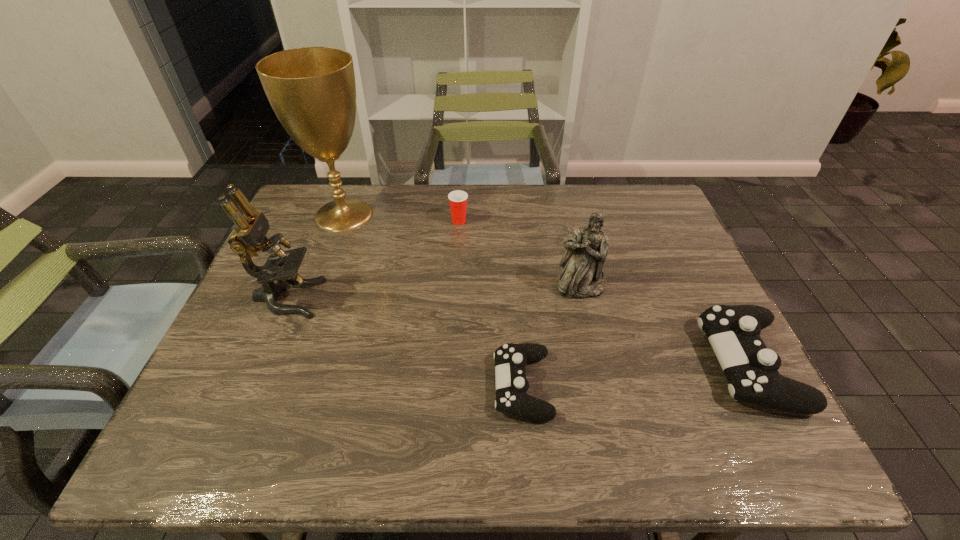
This screenshot has width=960, height=540. What are the coordinates of `blank space at the far left corner` in the screenshot? It's located at (348, 192).

You are a GUI agent. You are given a task and a screenshot of the screen. Output one action in this format:
    pyautogui.click(x=<x>, y=<y>)
    Task: Click on the free area in between the second object from right to left and the left control
    This screenshot has height=540, width=960.
    Given the screenshot: What is the action you would take?
    pyautogui.click(x=551, y=337)

Identify the location of free spot between the shortest object and the third object from left to right. (491, 303).

Find the location of `empty space between the microscope and the taller control`. empty space between the microscope and the taller control is located at coordinates (518, 331).

Locate an element on the screen. This screenshot has height=540, width=960. vacant space that's between the fifth object from left to right and the microscope is located at coordinates (434, 293).

Locate an element on the screen. free area in between the tallest object and the taller control is located at coordinates (546, 289).

I want to click on empty space that is in between the fourth object from left to right and the second tallest object, so click(x=405, y=342).

In order to click on vacant region between the fifth object from left to right and the trophy cup in this screenshot , I will do `click(462, 252)`.

Identify the location of free space between the trophy cup and the shortest object. (433, 300).

The image size is (960, 540). Identify the location of unoccupied position between the microscope and the third object from right to left. (405, 342).